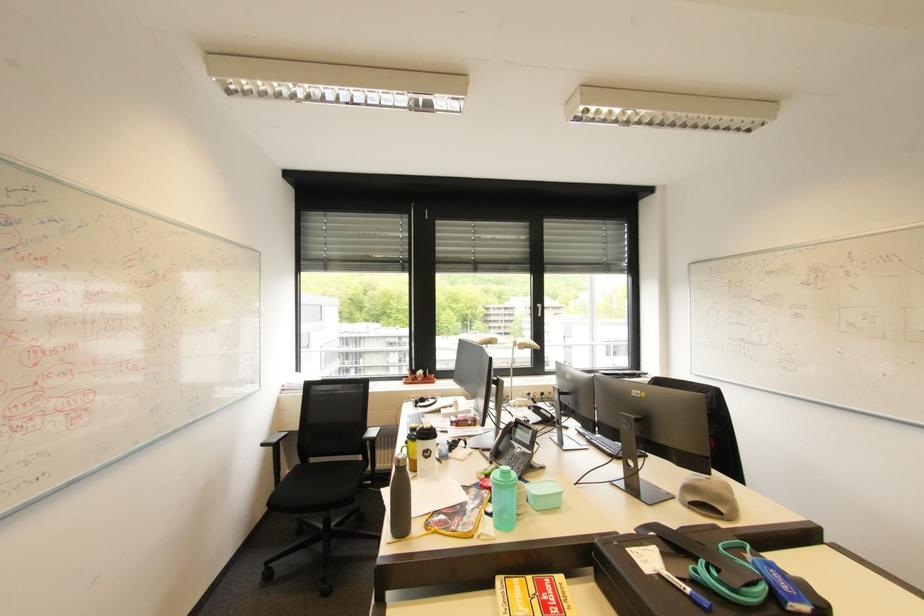
Identify the location of black chair sitting surface. (321, 485).